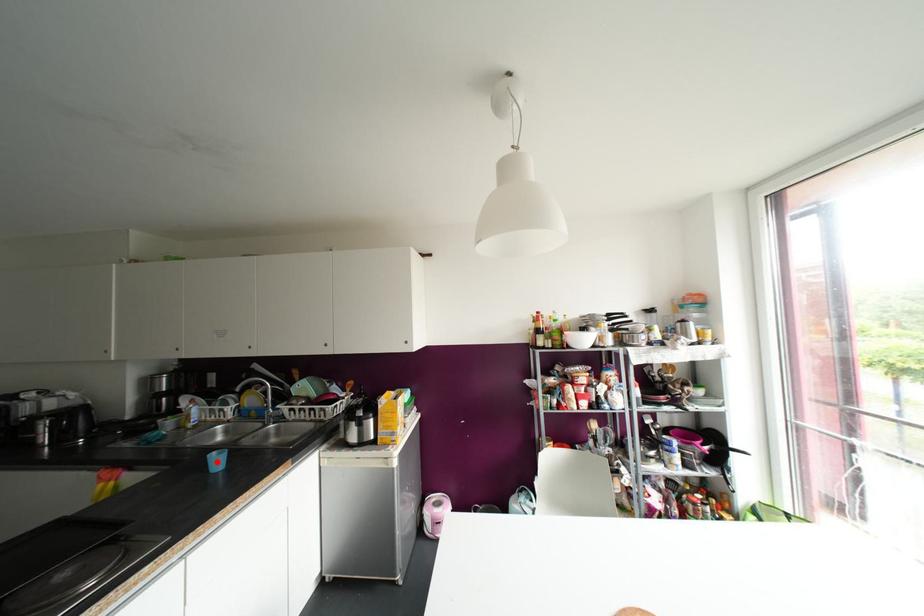
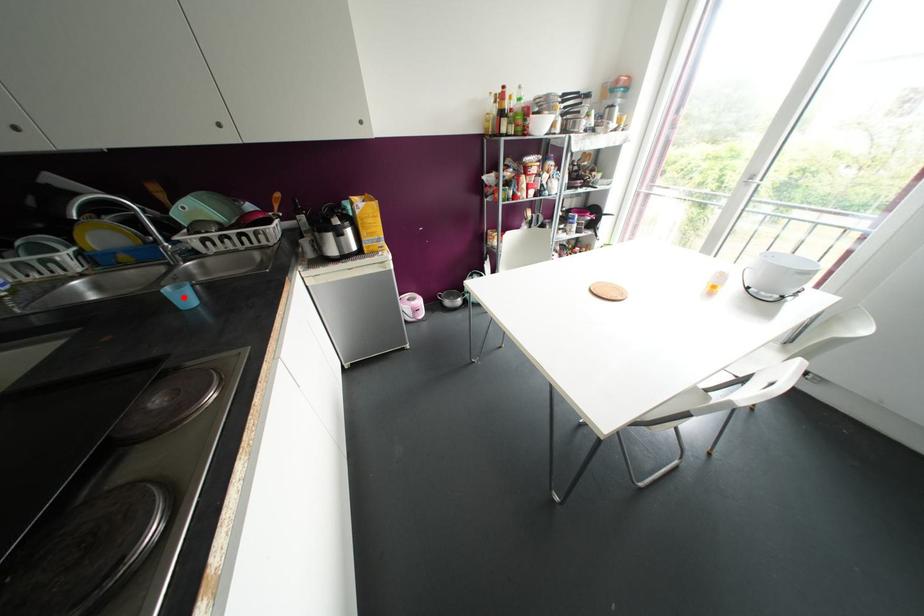
I am providing you with two images of the same scene from different viewpoints. A red point is marked on the first image and another point is marked on the second image. Is the red point in image1 aligned with the point shown in image2?

Yes